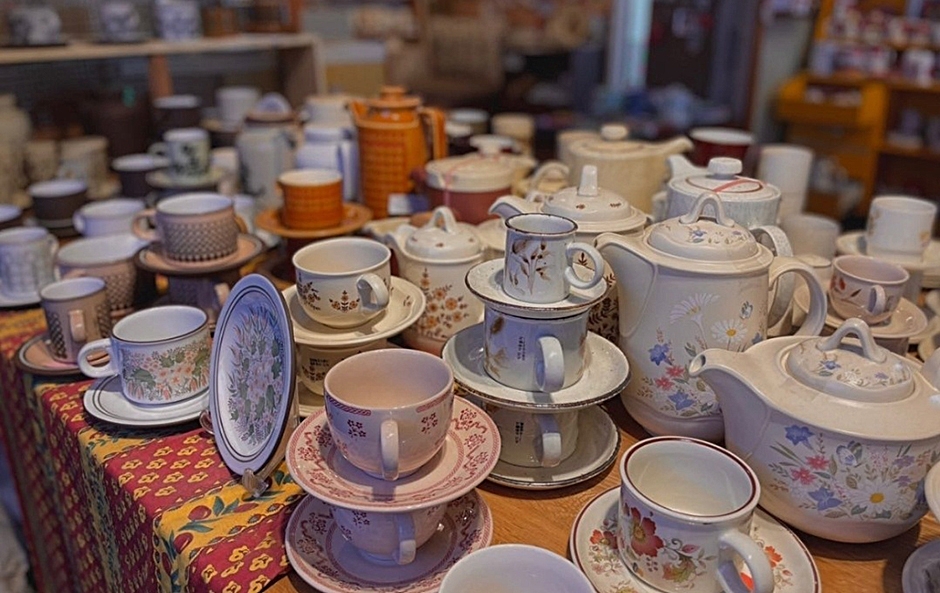
The width and height of the screenshot is (940, 593). I want to click on vintage teapot, so click(x=638, y=168), click(x=677, y=315), click(x=602, y=219), click(x=801, y=400), click(x=435, y=264), click(x=383, y=140), click(x=258, y=158), click(x=336, y=151).